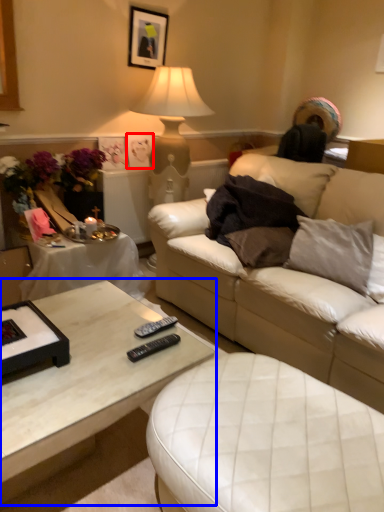
Question: Which object is further to the camera taking this photo, picture frame (highlighted by a red box) or coffee table (highlighted by a blue box)?

Choices:
 (A) picture frame
 (B) coffee table

Answer: (A)